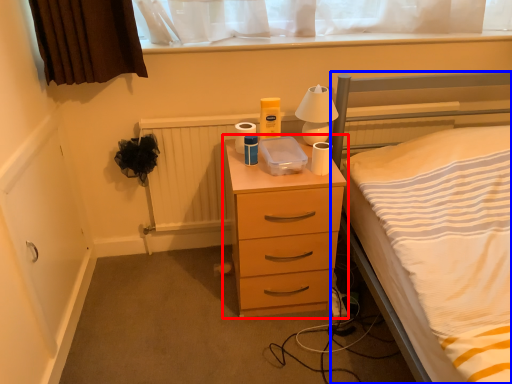
Question: Which object is further to the camera taking this photo, chest of drawers (highlighted by a red box) or bed (highlighted by a blue box)?

Choices:
 (A) chest of drawers
 (B) bed

Answer: (A)